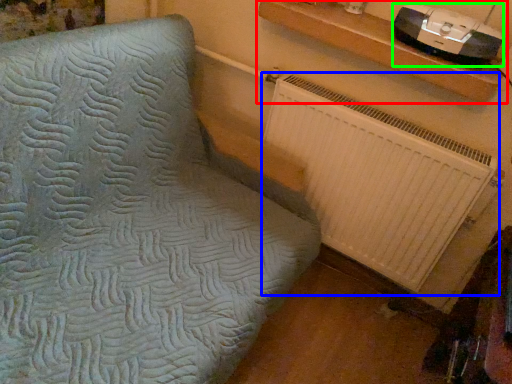
Question: Which object is positioned closest to shelf (highlighted by a red box)? Select from radiator (highlighted by a blue box) and stereo (highlighted by a green box).

Choices:
 (A) radiator
 (B) stereo

Answer: (B)